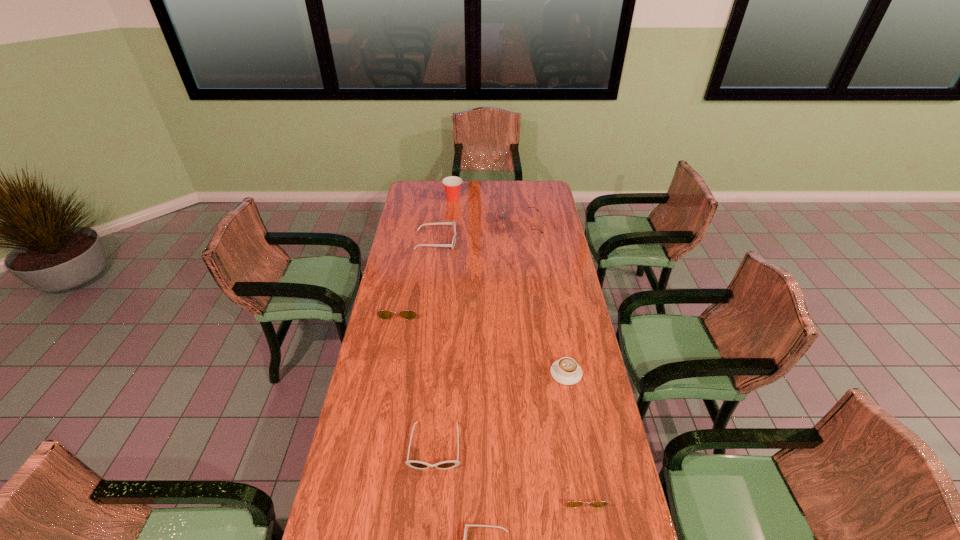
At what (x,y) coordinates should I click in order to perform the action: click on vacant region located on the front-facing side of the biggest green sunglasses. Please return your answer as a coordinate pair (x, y). The image size is (960, 540). Looking at the image, I should click on (488, 225).

Locate an element on the screen. This screenshot has height=540, width=960. free space located on the front-facing side of the biggest green sunglasses is located at coordinates (480, 225).

You are a GUI agent. You are given a task and a screenshot of the screen. Output one action in this format:
    pyautogui.click(x=<x>, y=<y>)
    Task: Click on the free space located 0.400m on the front-facing side of the biggest green sunglasses
    This screenshot has height=540, width=960.
    Given the screenshot: What is the action you would take?
    pyautogui.click(x=427, y=225)

Identify the location of free space located 0.170m with the lenses of the farthest black sunglasses facing outward. This screenshot has width=960, height=540. (491, 241).

Where is `vacant space located on the front-facing side of the leftmost green sunglasses`? The width and height of the screenshot is (960, 540). vacant space located on the front-facing side of the leftmost green sunglasses is located at coordinates (393, 346).

Where is `free point located 0.120m with the lenses of the second nearest black sunglasses facing outward`? free point located 0.120m with the lenses of the second nearest black sunglasses facing outward is located at coordinates (429, 514).

The width and height of the screenshot is (960, 540). I want to click on free point located with the handle on the right side of the fourth nearest object, so click(x=598, y=373).

Find the location of a particular element. This screenshot has width=960, height=540. vacant space located on the front-facing side of the smallest green sunglasses is located at coordinates (590, 539).

Identify the location of object located at the far edge. Image resolution: width=960 pixels, height=540 pixels. (452, 184).

Image resolution: width=960 pixels, height=540 pixels. I want to click on cappuccino situated at the right edge, so click(x=566, y=371).